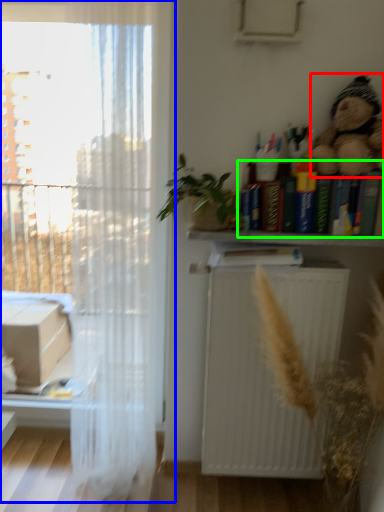
Question: Which object is the closest to the toy (highlighted by a red box)? Choose among these: window (highlighted by a blue box) or book (highlighted by a green box).

Choices:
 (A) window
 (B) book

Answer: (B)